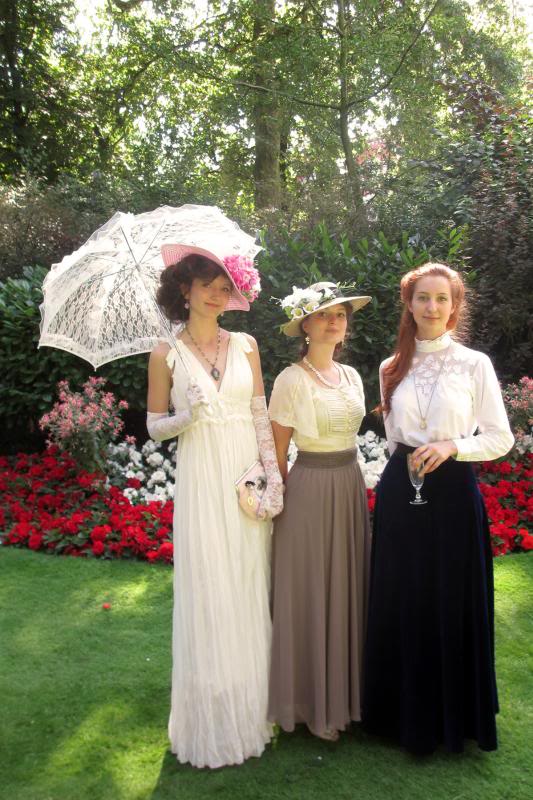
You are a GUI agent. You are given a task and a screenshot of the screen. Output one action in this format:
    pyautogui.click(x=<x>, y=<y>)
    Task: Click on the glass
    The width and height of the screenshot is (533, 800).
    Given the screenshot: What is the action you would take?
    pyautogui.click(x=415, y=480)